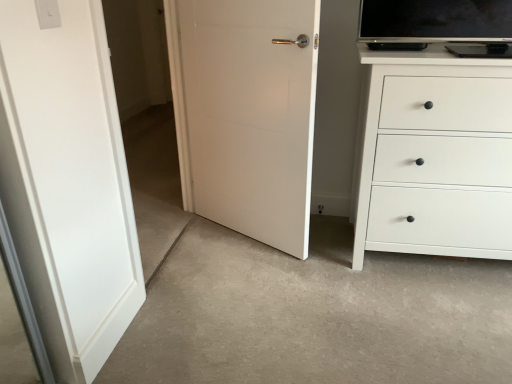
Find the location of `transparent glass door at left`. transparent glass door at left is located at coordinates (147, 124).

What are the coordinates of `white matte door at center` in the screenshot? It's located at (251, 114).

Where is `transparent glass door at left`? This screenshot has height=384, width=512. transparent glass door at left is located at coordinates (147, 124).

Considering the relative sizes of white matte door at center and transparent glass door at left in the image provided, is white matte door at center bigger than transparent glass door at left?

Yes, white matte door at center is bigger than transparent glass door at left.

Can you confirm if white matte door at center is shorter than transparent glass door at left?

Yes, white matte door at center is shorter than transparent glass door at left.

Is white matte door at center looking in the opposite direction of transparent glass door at left?

Yes.

Which is in front, point (212, 71) or point (164, 173)?

Positioned in front is point (212, 71).

Would you say white plastic light switch at upper left is part of transparent glass door at left's contents?

No, white plastic light switch at upper left is not inside transparent glass door at left.

Does transparent glass door at left have a smaller size compared to white plastic light switch at upper left?

Incorrect, transparent glass door at left is not smaller in size than white plastic light switch at upper left.

How many degrees apart are the facing directions of transparent glass door at left and white plastic light switch at upper left?

1.15 degrees.

From the image's perspective, does transparent glass door at left appear higher than white plastic light switch at upper left?

Actually, transparent glass door at left appears below white plastic light switch at upper left in the image.

Considering the sizes of white matte door at center and white plastic light switch at upper left in the image, is white matte door at center taller or shorter than white plastic light switch at upper left?

white matte door at center is taller than white plastic light switch at upper left.

Where is `light switch on the left of the white matte door at center`? light switch on the left of the white matte door at center is located at coordinates (48, 13).

Consider the image. From the image's perspective, which object appears higher, white matte door at center or white plastic light switch at upper left?

white plastic light switch at upper left is shown above in the image.

From the picture: How many degrees apart are the facing directions of white matte door at center and white plastic light switch at upper left?

The facing directions of white matte door at center and white plastic light switch at upper left are 117 degrees apart.

Which is more to the right, white matte door at center or white matte chest of drawers at right?

Positioned to the right is white matte chest of drawers at right.

Can you see white matte door at center touching white matte chest of drawers at right?

white matte door at center and white matte chest of drawers at right are clearly separated.

Does white matte door at center have a lesser height compared to white matte chest of drawers at right?

No.

Can we say white matte door at center lies outside white matte chest of drawers at right?

white matte door at center is positioned outside white matte chest of drawers at right.

Considering the positions of objects transparent glass door at left and white matte door at center in the image provided, who is behind, transparent glass door at left or white matte door at center?

white matte door at center is further away from the camera.

From the image's perspective, is transparent glass door at left above or below white matte door at center?

transparent glass door at left is situated lower than white matte door at center in the image.

In terms of height, does transparent glass door at left look taller or shorter compared to white matte door at center?

transparent glass door at left is taller than white matte door at center.

Identify the location of chest of drawers that is on the right side of white matte door at center. (435, 156).

Considering the relative sizes of white matte chest of drawers at right and white matte door at center in the image provided, is white matte chest of drawers at right wider than white matte door at center?

Yes, white matte chest of drawers at right is wider than white matte door at center.

Is white matte chest of drawers at right looking in the opposite direction of white matte door at center?

No, white matte chest of drawers at right is not facing the opposite direction of white matte door at center.

From a real-world perspective, which is physically below, white matte chest of drawers at right or white matte door at center?

white matte chest of drawers at right, from a real-world perspective.

Considering the relative sizes of white matte chest of drawers at right and white plastic light switch at upper left in the image provided, is white matte chest of drawers at right bigger than white plastic light switch at upper left?

Indeed, white matte chest of drawers at right has a larger size compared to white plastic light switch at upper left.

From the image's perspective, between white matte chest of drawers at right and white plastic light switch at upper left, who is located below?

From the image's view, white matte chest of drawers at right is below.

Does white matte chest of drawers at right have a greater height compared to white plastic light switch at upper left?

Yes, white matte chest of drawers at right is taller than white plastic light switch at upper left.

From a real-world perspective, which is physically below, white matte chest of drawers at right or white plastic light switch at upper left?

From a 3D spatial view, white matte chest of drawers at right is below.

Locate an element on the screen. Image resolution: width=512 pixels, height=384 pixels. glass door in front of the white matte door at center is located at coordinates (147, 124).

Image resolution: width=512 pixels, height=384 pixels. I want to click on glass door that is on the right side of white plastic light switch at upper left, so click(x=147, y=124).

Looking at the image, which one is located closer to transparent glass door at left, white plastic light switch at upper left or white matte chest of drawers at right?

Among the two, white matte chest of drawers at right is located nearer to transparent glass door at left.

From the image, which object appears to be farther from white matte door at center, white plastic light switch at upper left or transparent glass door at left?

white plastic light switch at upper left is positioned further to the anchor white matte door at center.

Looking at the image, which one is located closer to transparent glass door at left, white plastic light switch at upper left or white matte door at center?

Based on the image, white matte door at center appears to be nearer to transparent glass door at left.

Estimate the real-world distances between objects in this image. Which object is further from white matte door at center, transparent glass door at left or white plastic light switch at upper left?

white plastic light switch at upper left.

When comparing their distances from transparent glass door at left, does white matte door at center or white matte chest of drawers at right seem further?

white matte chest of drawers at right is further to transparent glass door at left.

Considering their positions, is transparent glass door at left positioned closer to white matte chest of drawers at right than white plastic light switch at upper left?

Based on the image, white plastic light switch at upper left appears to be nearer to white matte chest of drawers at right.

Based on their spatial positions, is white matte chest of drawers at right or transparent glass door at left further from white matte door at center?

The object further to white matte door at center is transparent glass door at left.

Which object lies further to the anchor point white matte door at center, transparent glass door at left or white matte chest of drawers at right?

Based on the image, transparent glass door at left appears to be further to white matte door at center.

Locate an element on the screen. The width and height of the screenshot is (512, 384). door between white plastic light switch at upper left and white matte chest of drawers at right from left to right is located at coordinates (251, 114).

At what (x,y) coordinates should I click in order to perform the action: click on glass door situated between white plastic light switch at upper left and white matte door at center from left to right. Please return your answer as a coordinate pair (x, y). This screenshot has height=384, width=512. Looking at the image, I should click on (147, 124).

Where is `door between transparent glass door at left and white matte chest of drawers at right from left to right`? Image resolution: width=512 pixels, height=384 pixels. door between transparent glass door at left and white matte chest of drawers at right from left to right is located at coordinates (251, 114).

I want to click on glass door located between white plastic light switch at upper left and white matte chest of drawers at right in the left-right direction, so click(x=147, y=124).